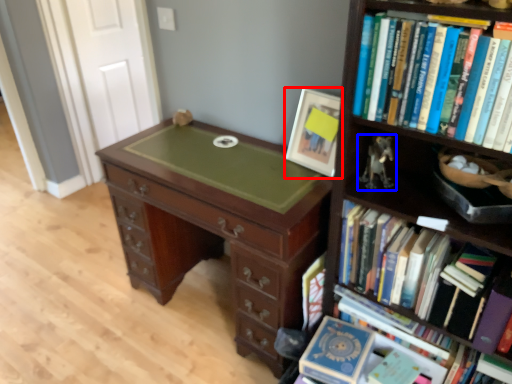
Question: Among these objects, which one is farthest to the camera, picture frame (highlighted by a red box) or toy (highlighted by a blue box)?

Choices:
 (A) picture frame
 (B) toy

Answer: (A)